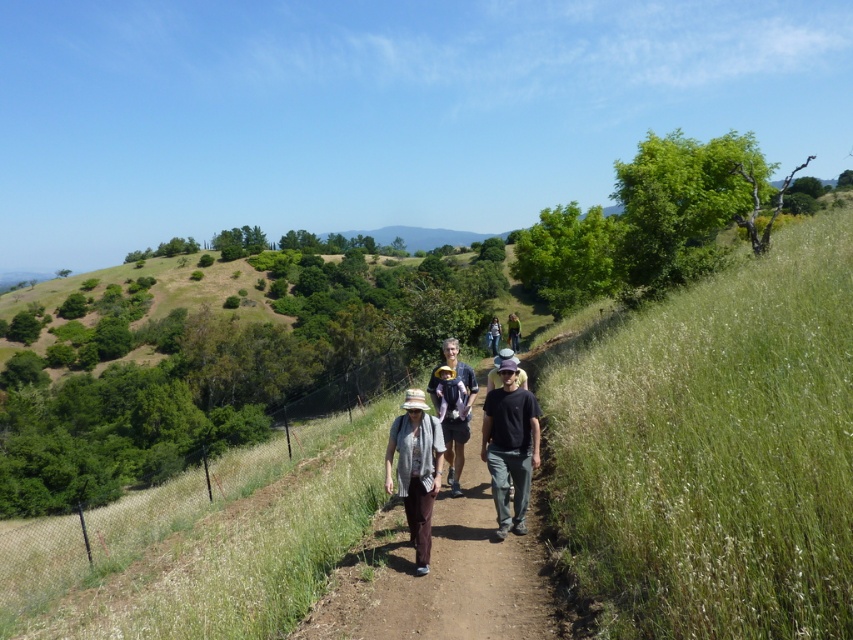
Which is behind, point (514, 394) or point (515, 326)?

Positioned behind is point (515, 326).

What do you see at coordinates (509, 445) in the screenshot?
I see `black cotton shirt at center` at bounding box center [509, 445].

Find the location of `black cotton shirt at center`. black cotton shirt at center is located at coordinates (509, 445).

Does green grassy hillside at right appear on the left side of denim jacket at center?

No, green grassy hillside at right is not to the left of denim jacket at center.

Describe the element at coordinates (715, 449) in the screenshot. The width and height of the screenshot is (853, 640). I see `green grassy hillside at right` at that location.

The image size is (853, 640). I want to click on green grassy hillside at right, so click(715, 449).

Describe the element at coordinates (444, 573) in the screenshot. I see `brown dirt path at center` at that location.

Between brown dirt path at center and light brown leather jacket at center, which one appears on the left side from the viewer's perspective?

Positioned to the left is brown dirt path at center.

Who is more forward, (512,573) or (509,330)?

Point (512,573)

In order to click on brown dirt path at center in this screenshot , I will do `click(444, 573)`.